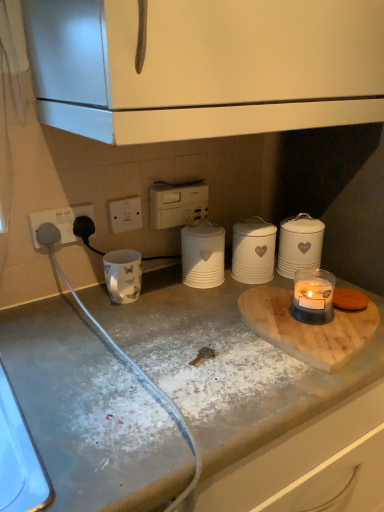
Image resolution: width=384 pixels, height=512 pixels. I want to click on free space to the left of white ceramic canister at center, which ranks as the 2th appliance in top-to-bottom order, so click(156, 288).